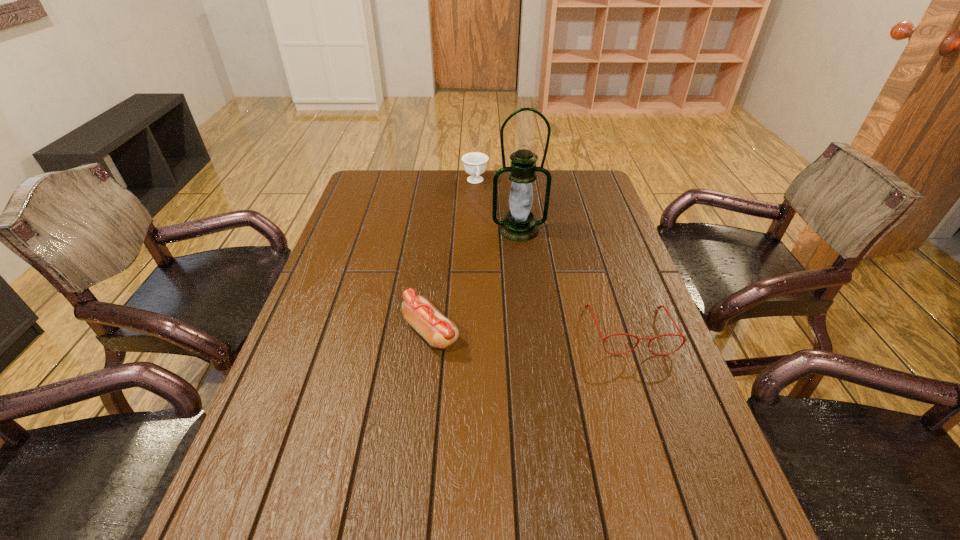
The image size is (960, 540). Find the location of `vacant area between the sausage and the spectacles`. vacant area between the sausage and the spectacles is located at coordinates (530, 331).

The image size is (960, 540). I want to click on empty location between the sausage and the third nearest object, so click(475, 281).

Where is `vacant region between the spectacles and the sausage`? The image size is (960, 540). vacant region between the spectacles and the sausage is located at coordinates (530, 331).

The width and height of the screenshot is (960, 540). I want to click on vacant space that is in between the sausage and the rightmost object, so click(530, 331).

Locate an element on the screen. The width and height of the screenshot is (960, 540). empty space between the rightmost object and the lantern is located at coordinates (574, 280).

Identify the location of free spot between the sausage and the spectacles. This screenshot has width=960, height=540. (530, 331).

You are a GUI agent. You are given a task and a screenshot of the screen. Output one action in this format:
    pyautogui.click(x=<x>, y=<y>)
    Task: Click on the free point between the lantern and the farthest object
    The image size is (960, 540).
    Given the screenshot: What is the action you would take?
    pyautogui.click(x=497, y=206)

Identify the location of free spot between the sausage and the teacup. (453, 257).

Where is `vacant space that is in between the lantern and the sausage`? The height and width of the screenshot is (540, 960). vacant space that is in between the lantern and the sausage is located at coordinates (475, 281).

This screenshot has height=540, width=960. In order to click on free space between the spectacles and the sausage in this screenshot , I will do `click(530, 331)`.